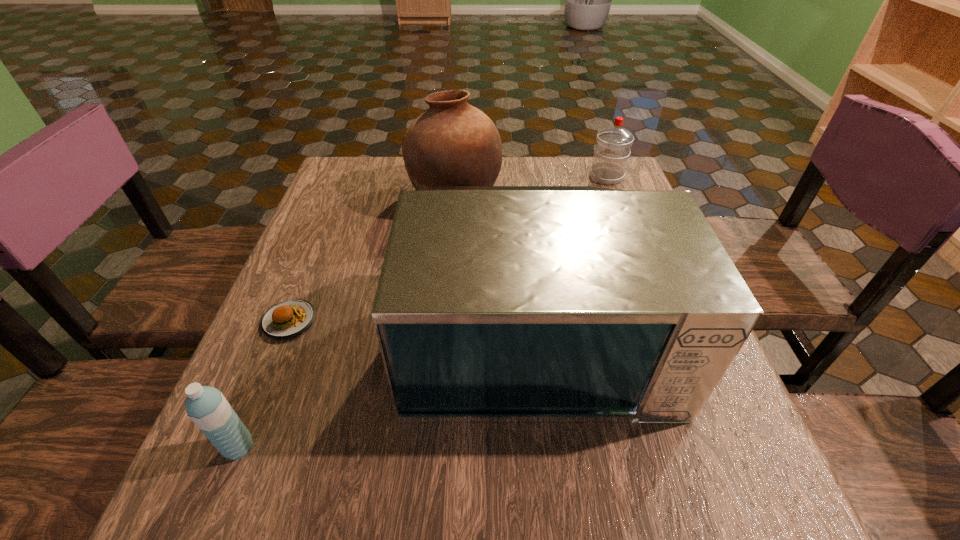
Image resolution: width=960 pixels, height=540 pixels. I want to click on vacant area situated 0.360m on the back of the food, so click(338, 201).

What are the coordinates of `pottery that is at the far edge` in the screenshot? It's located at (453, 143).

Where is `water bottle located at the far edge`? Image resolution: width=960 pixels, height=540 pixels. water bottle located at the far edge is located at coordinates (613, 145).

In order to click on water bottle situated at the left edge in this screenshot , I will do `click(208, 409)`.

Identify the location of food present at the left edge. This screenshot has height=540, width=960. (289, 318).

Identify the location of microwave oven that is positioned at the right edge. (495, 304).

Find the location of `water bottle at the right edge`. water bottle at the right edge is located at coordinates [613, 145].

I want to click on object located at the far right corner, so click(x=613, y=145).

The height and width of the screenshot is (540, 960). I want to click on vacant space at the far edge of the desktop, so click(546, 166).

Image resolution: width=960 pixels, height=540 pixels. I want to click on vacant space at the near edge of the desktop, so click(x=402, y=502).